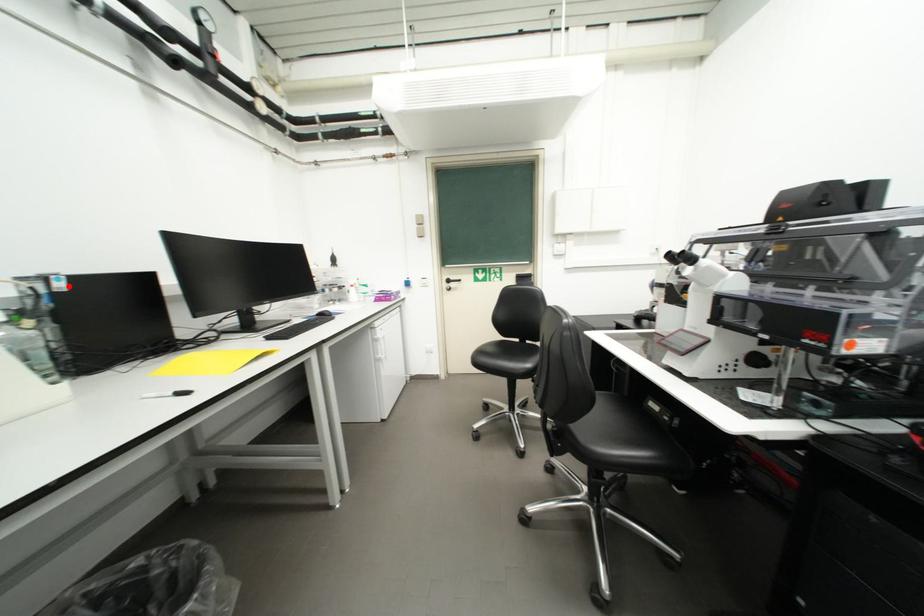
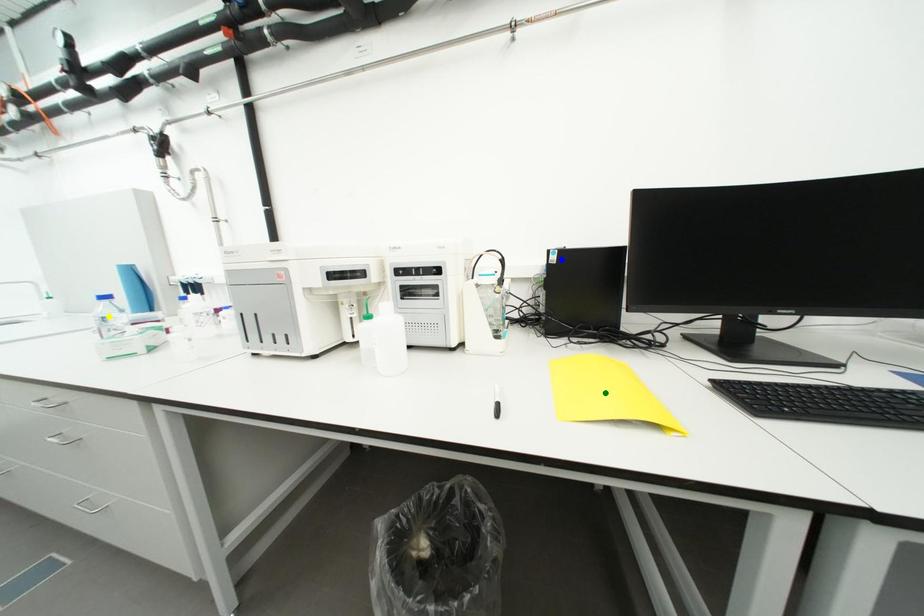
Question: I am providing you with two images of the same scene from different viewpoints. A red point is marked on the first image. You are given multiple points on the second image. Can you choose the point in image 2 that corresponds to the point in image 1?

Choices:
 (A) green point
 (B) yellow point
 (C) blue point

Answer: (C)